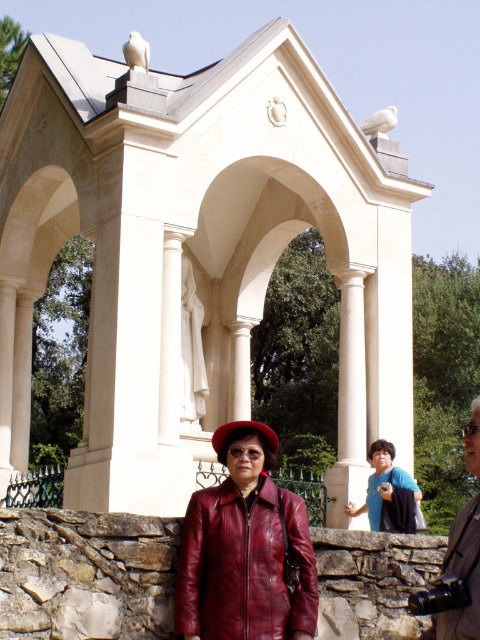
You are standing in front of the classical pavilion and want to take a photo. There are two points marked in the image, point 1 at coordinates point (x=239, y=609) and point 2 at coordinates point (x=387, y=486). Which point is closer to you?

Point (x=239, y=609) is closer to the camera than point (x=387, y=486), so the point closer to you is point (x=239, y=609).

You are a photographer trying to capture the person in the scene. The person is wearing a red leather jacket at center and a red leather hat at center. Which clothing item is closer to the camera?

The leather jacket at center is closer to the camera because it is in front of the red leather hat at center.

You are an artist preparing to sketch this scene. You need to decide which object, the leather jacket at center or the blue fabric bag at center, should be drawn larger in terms of height to accurately represent their sizes as seen in the image. Which one should you depict as taller?

The leather jacket at center has a greater height compared to the blue fabric bag at center, so you should draw the leather jacket at center taller than the blue fabric bag at center.